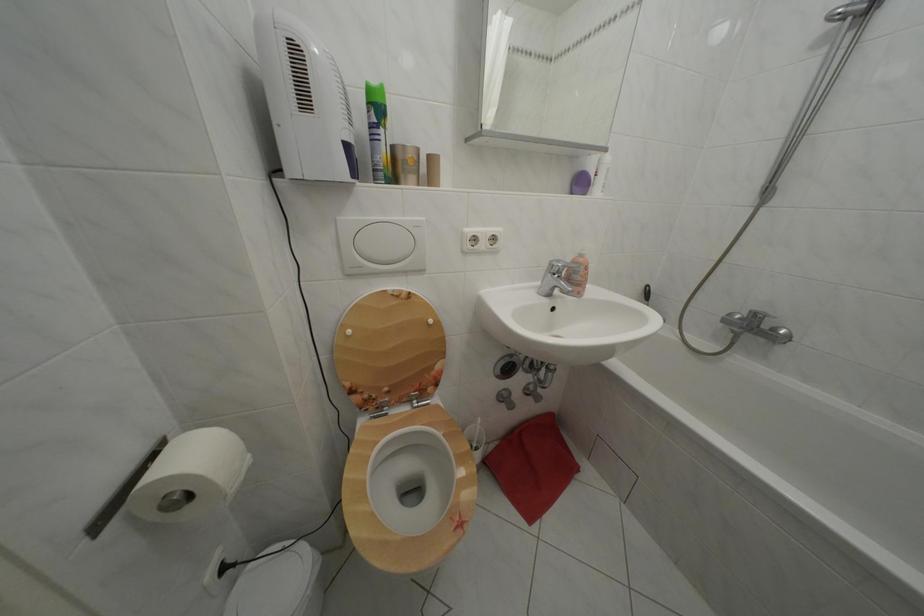
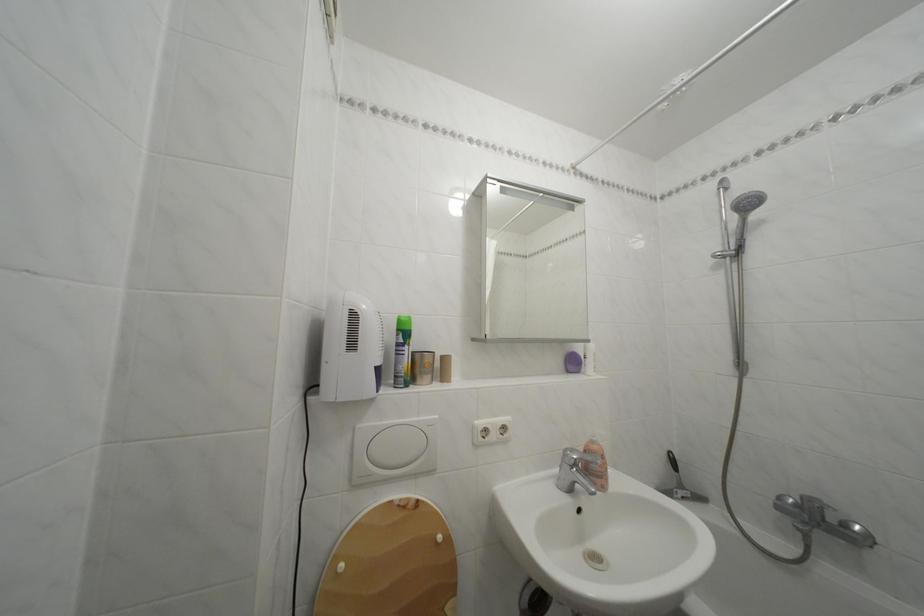
In the second image, find the point that corresponds to [378,110] in the first image.

(407, 336)